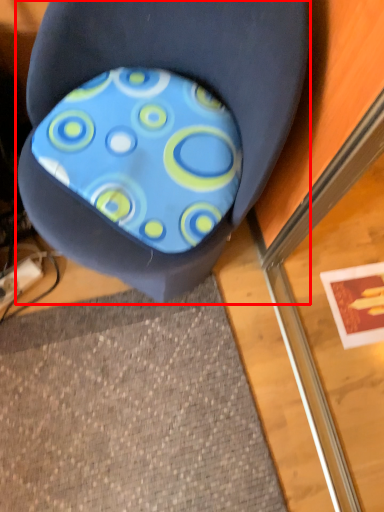
Question: From the image, what is the correct spatial relationship of chair (annotated by the red box) in relation to design?

Choices:
 (A) right
 (B) left

Answer: (B)